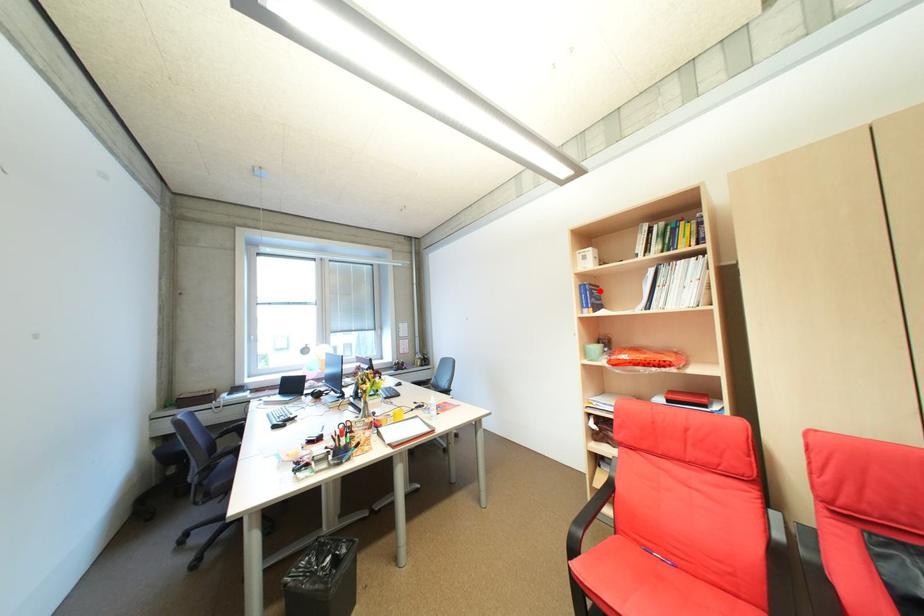
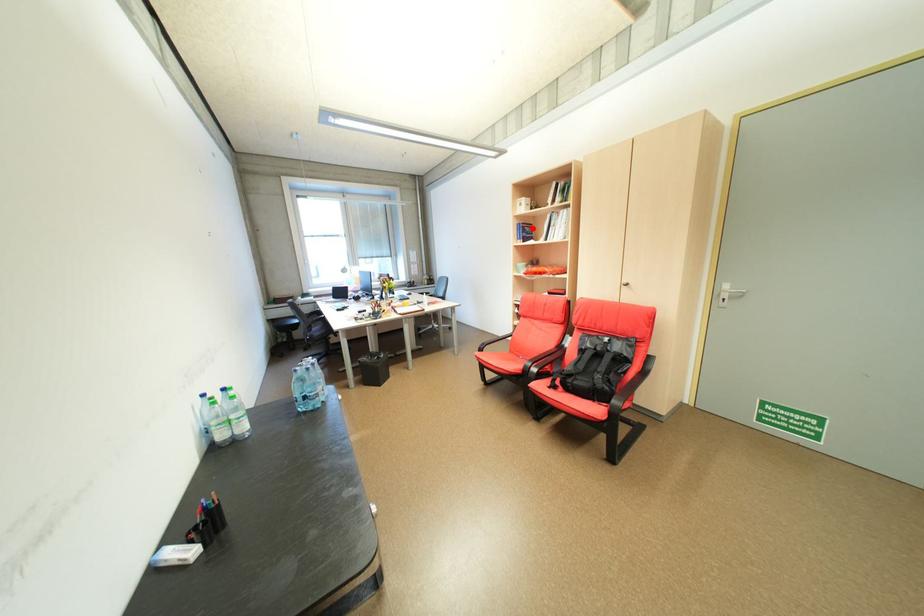
Looking at this image, I am providing you with two images of the same scene from different viewpoints. A red point is marked on the first image and another point is marked on the second image. Is the red point in image1 aligned with the point shown in image2?

Yes